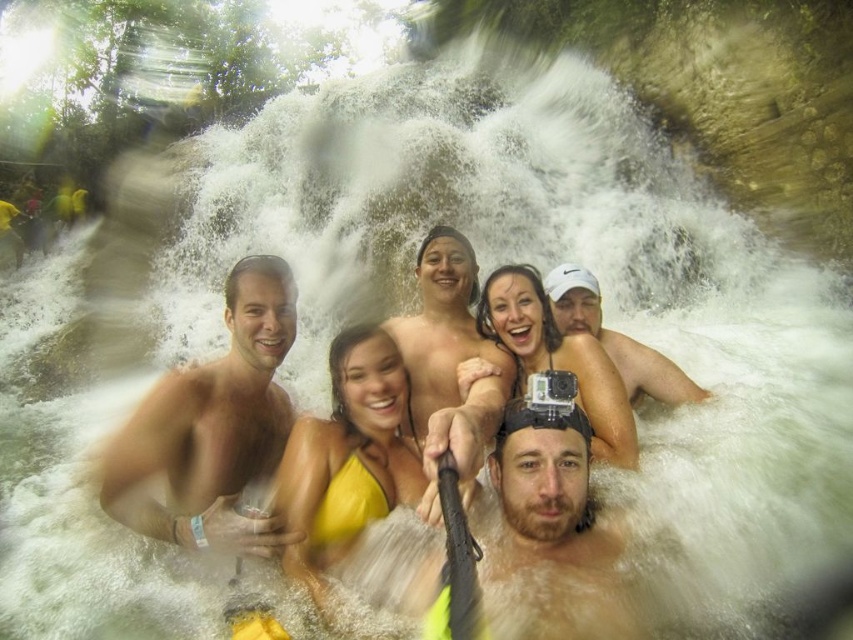
Is bearded man at center below yellow fabric bikini at center?

Yes.

How distant is bearded man at center from yellow fabric bikini at center?

They are 5.71 meters apart.

Between point (561, 529) and point (558, 364), which one is positioned behind?

Positioned behind is point (558, 364).

Where is `bearded man at center`? The height and width of the screenshot is (640, 853). bearded man at center is located at coordinates (554, 525).

Does smooth skin man at center have a lesser width compared to yellow satin swimsuit at center?

No, smooth skin man at center is not thinner than yellow satin swimsuit at center.

Is smooth skin man at center smaller than yellow satin swimsuit at center?

Incorrect, smooth skin man at center is not smaller in size than yellow satin swimsuit at center.

Locate an element on the screen. This screenshot has width=853, height=640. smooth skin man at center is located at coordinates (212, 426).

Is yellow satin swimsuit at center bigger than white matte camera at center?

Yes.

Can you confirm if yellow satin swimsuit at center is thinner than white matte camera at center?

Indeed, yellow satin swimsuit at center has a lesser width compared to white matte camera at center.

Does point (312, 465) come closer to viewer compared to point (572, 298)?

Yes, it is in front of point (572, 298).

This screenshot has height=640, width=853. Identify the location of yellow satin swimsuit at center. (347, 456).